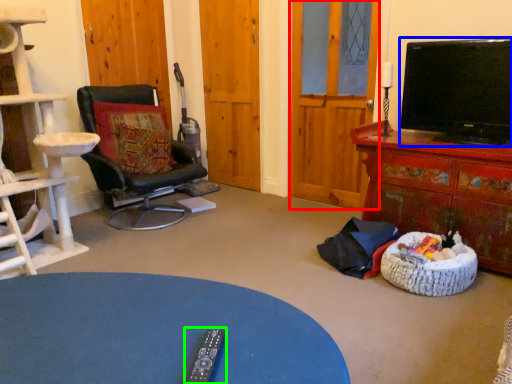
Question: Considering the real-world distances, which object is closest to glass door (highlighted by a red box)? television (highlighted by a blue box) or remote (highlighted by a green box).

Choices:
 (A) television
 (B) remote

Answer: (A)